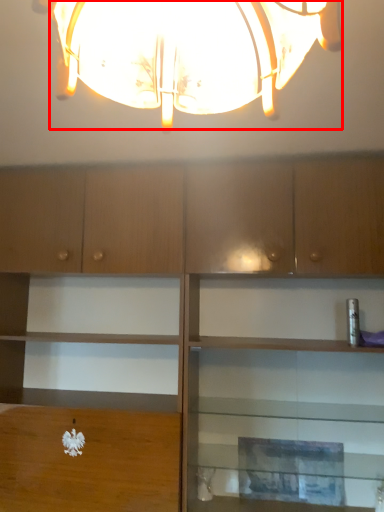
Question: From the image's perspective, what is the correct spatial positioning of lamp (annotated by the red box) in reference to cabinetry?

Choices:
 (A) above
 (B) below

Answer: (A)